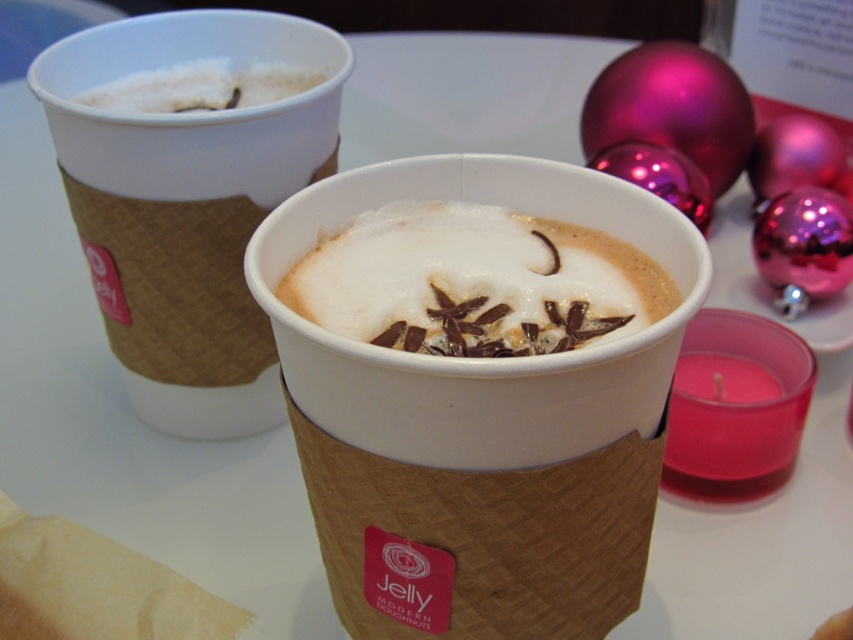
You are a barista trying to clean up the workspace. You need to move the white foam coffee at upper left and the white frothy foam at center. Which object should you move first to reach the candle on the right without disturbing the other?

You should move the white frothy foam at center first because it is behind the white foam coffee at upper left. By moving the one in front first, you can then access the one behind without disturbing it.

You are a barista trying to place a new coffee cup between the white foam coffee at upper left and the white frothy foam at upper left. The new cup is 3 inches in diameter. Is there enough space between them to fit the new cup?

The distance between the white foam coffee at upper left and the white frothy foam at upper left is 4.86 inches. Since the new cup is 3 inches in diameter, there is enough space to fit it between them.

What are the coordinates of the white foam coffee at upper left?

The white foam coffee at upper left is located at coordinates point (189, 193).